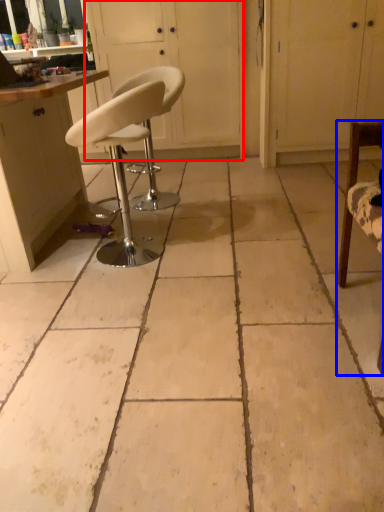
Question: Among these objects, which one is farthest to the camera, screen door (highlighted by a red box) or chair (highlighted by a blue box)?

Choices:
 (A) screen door
 (B) chair

Answer: (A)